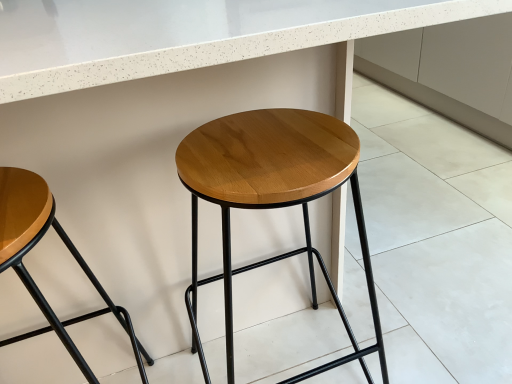
The width and height of the screenshot is (512, 384). I want to click on free location to the right of wooden/matte stool at center, placed as the 1th stool when sorted from right to left, so click(x=410, y=331).